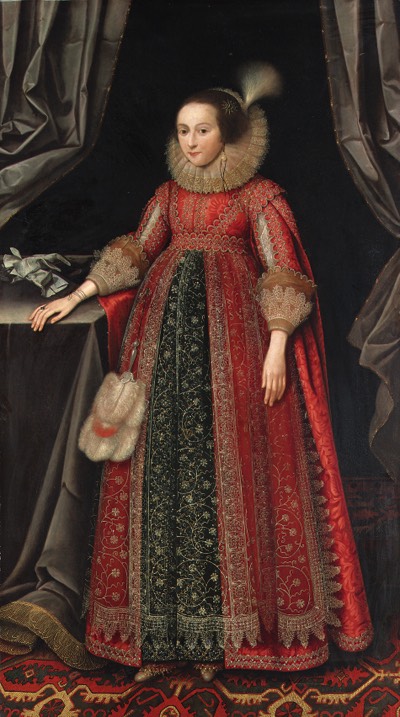
This screenshot has height=717, width=400. I want to click on gray curtains, so click(95, 44), click(344, 65).